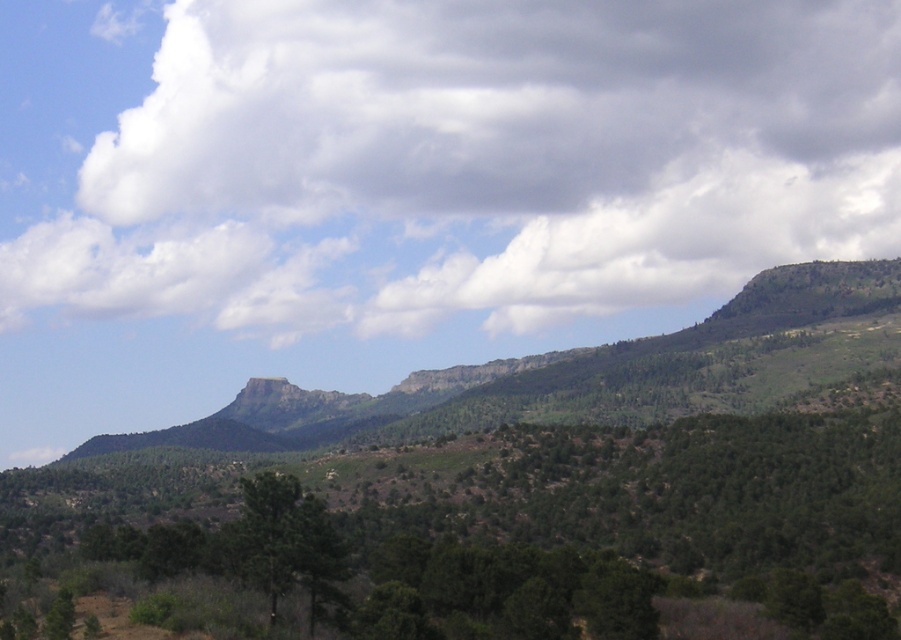
Question: Among these objects, which one is nearest to the camera?

Choices:
 (A) green textured hillside at center
 (B) green matte tree at center

Answer: (B)

Question: Based on their relative distances, which object is nearer to the green textured hillside at center?

Choices:
 (A) white fluffy cloud at upper center
 (B) green matte tree at center

Answer: (B)

Question: Is green textured hillside at center further to the viewer compared to white fluffy cloud at upper center?

Choices:
 (A) no
 (B) yes

Answer: (A)

Question: Can you confirm if green textured hillside at center is thinner than white fluffy cloud at upper center?

Choices:
 (A) no
 (B) yes

Answer: (B)

Question: Can you confirm if green textured hillside at center is positioned above white fluffy cloud at upper center?

Choices:
 (A) no
 (B) yes

Answer: (A)

Question: Which point is farther to the camera?

Choices:
 (A) white fluffy cloud at upper center
 (B) green matte tree at center
 (C) green textured hillside at center

Answer: (A)